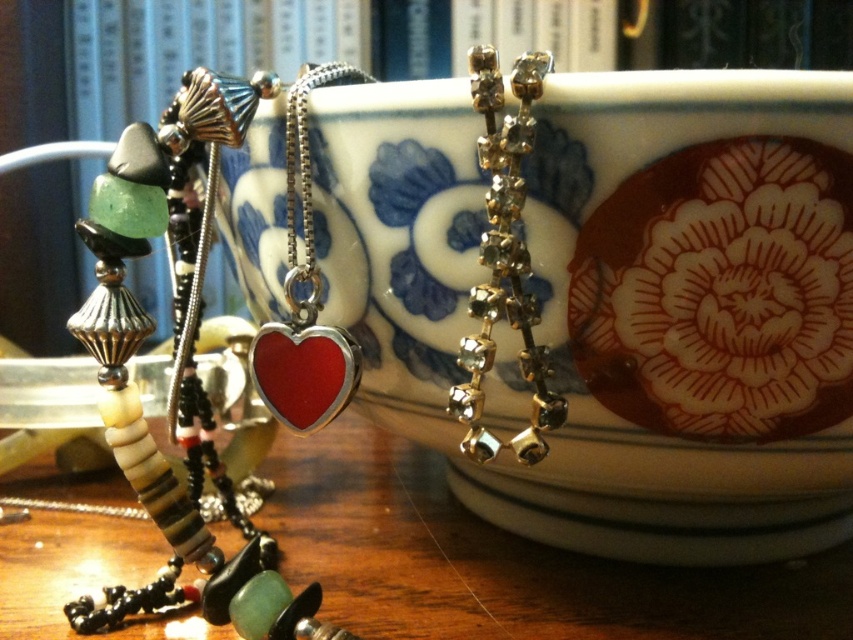
Question: Can you confirm if clear crystal earrings at upper center is wider than shiny silver heart at center?

Choices:
 (A) yes
 (B) no

Answer: (B)

Question: Is the position of clear crystal earrings at upper center more distant than that of shiny silver heart at center?

Choices:
 (A) yes
 (B) no

Answer: (B)

Question: Estimate the real-world distances between objects in this image. Which object is closer to the shiny silver heart at center?

Choices:
 (A) shiny red heart at center
 (B) shiny red heart pendant at center

Answer: (A)

Question: Among these points, which one is farthest from the camera?

Choices:
 (A) (302, 403)
 (B) (323, 406)
 (C) (194, 451)
 (D) (509, 134)

Answer: (C)

Question: Does shiny red heart pendant at center have a smaller size compared to shiny red heart at center?

Choices:
 (A) no
 (B) yes

Answer: (A)

Question: Which point is farther from the camera taking this photo?

Choices:
 (A) (308, 84)
 (B) (291, 275)
 (C) (485, 163)

Answer: (A)